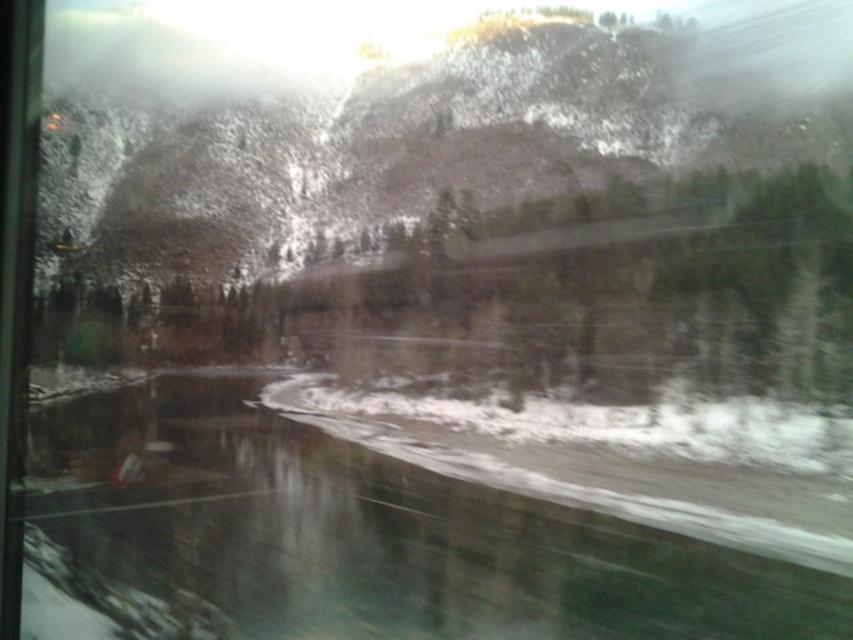
Question: Is the position of clear water at bottom less distant than that of white powdery snow at center?

Choices:
 (A) yes
 (B) no

Answer: (A)

Question: Can you confirm if clear water at bottom is positioned below white powdery snow at center?

Choices:
 (A) no
 (B) yes

Answer: (A)

Question: Which of the following is the closest to the observer?

Choices:
 (A) (650, 404)
 (B) (401, 480)

Answer: (B)

Question: From the image, what is the correct spatial relationship of clear water at bottom in relation to white powdery snow at center?

Choices:
 (A) above
 (B) below

Answer: (A)

Question: Among these objects, which one is nearest to the camera?

Choices:
 (A) white powdery snow at center
 (B) clear water at bottom

Answer: (B)